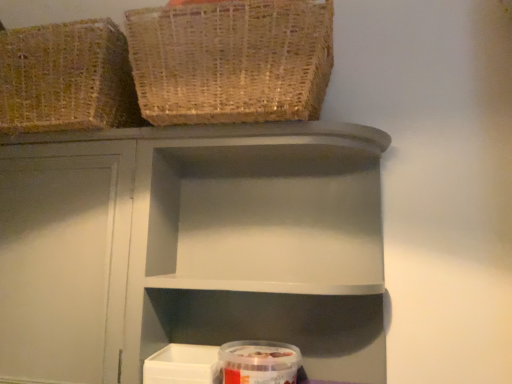
Question: Does matte gray shelf at center have a greater width compared to woven natural basket at upper left, the 1th basket in the left-to-right sequence?

Choices:
 (A) no
 (B) yes

Answer: (A)

Question: Is matte gray shelf at center looking in the opposite direction of woven natural basket at upper left, which is the second basket in right-to-left order?

Choices:
 (A) no
 (B) yes

Answer: (A)

Question: From the image's perspective, is matte gray shelf at center on woven natural basket at upper left, the 1th basket in the left-to-right sequence?

Choices:
 (A) yes
 (B) no

Answer: (B)

Question: From the image's perspective, is matte gray shelf at center beneath woven natural basket at upper left, the 1th basket in the left-to-right sequence?

Choices:
 (A) yes
 (B) no

Answer: (A)

Question: Can you confirm if matte gray shelf at center is thinner than woven natural basket at upper left, the 1th basket in the left-to-right sequence?

Choices:
 (A) yes
 (B) no

Answer: (A)

Question: Is matte gray shelf at center shorter than woven natural basket at upper left, which is the second basket in right-to-left order?

Choices:
 (A) yes
 (B) no

Answer: (B)

Question: Is woven natural basket at upper left, which is the second basket in right-to-left order, looking in the opposite direction of matte gray shelf at center?

Choices:
 (A) no
 (B) yes

Answer: (A)

Question: From a real-world perspective, is woven natural basket at upper left, the 1th basket in the left-to-right sequence, positioned under matte gray shelf at center based on gravity?

Choices:
 (A) no
 (B) yes

Answer: (A)

Question: Are woven natural basket at upper left, which is the second basket in right-to-left order, and matte gray shelf at center making contact?

Choices:
 (A) no
 (B) yes

Answer: (A)

Question: Does woven natural basket at upper left, which is the second basket in right-to-left order, have a smaller size compared to matte gray shelf at center?

Choices:
 (A) yes
 (B) no

Answer: (A)

Question: Is woven natural basket at upper left, which is the second basket in right-to-left order, not within matte gray shelf at center?

Choices:
 (A) no
 (B) yes

Answer: (B)

Question: From the image's perspective, does woven natural basket at upper left, the 1th basket in the left-to-right sequence, appear lower than matte gray shelf at center?

Choices:
 (A) yes
 (B) no

Answer: (B)

Question: Can you confirm if transparent plastic container at lower center is shorter than woven natural basket at upper left, acting as the 1th basket starting from the right?

Choices:
 (A) no
 (B) yes

Answer: (B)